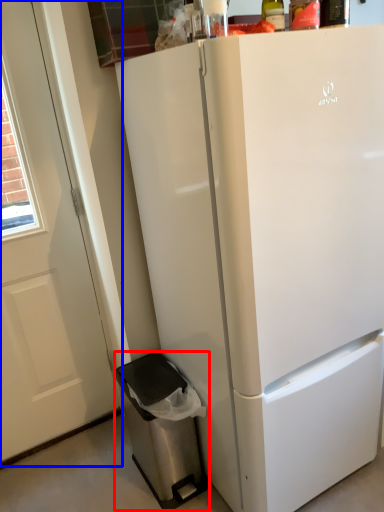
Question: Among these objects, which one is nearest to the camera, dish washer (highlighted by a red box) or screen door (highlighted by a blue box)?

Choices:
 (A) dish washer
 (B) screen door

Answer: (B)